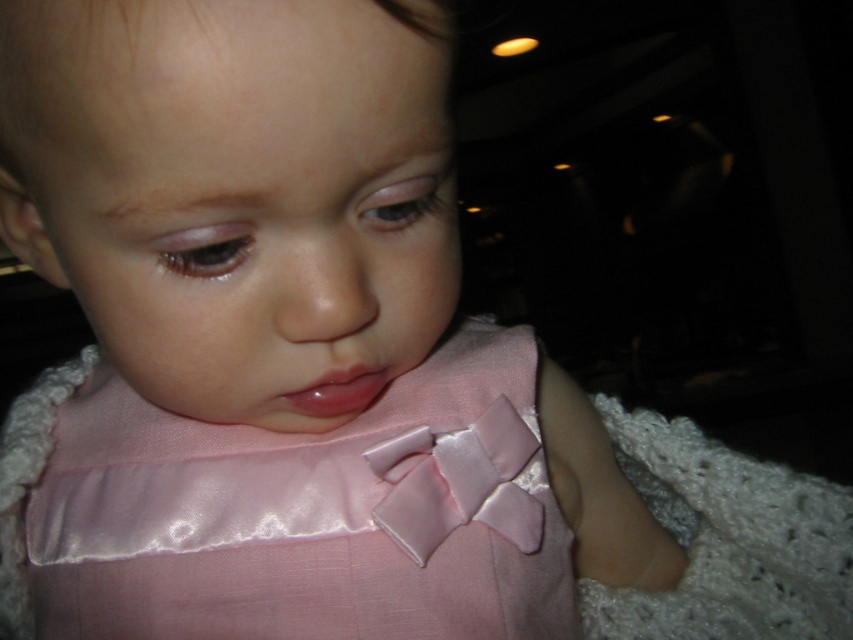
You are a photographer adjusting your camera focus. You need to focus on both the point at (x=412, y=372) and the point at (x=314, y=390). Which point should you focus on first to ensure the closer one is sharp?

You should focus on point (x=314, y=390) first because it is closer to the camera than point (x=412, y=372), ensuring the closer object is in focus.

The child is wearing a satin pink dress at center and has glossy pink lips at center. Where is the dress in relation to the lips?

The satin pink dress at center is below the glossy pink lips at center.